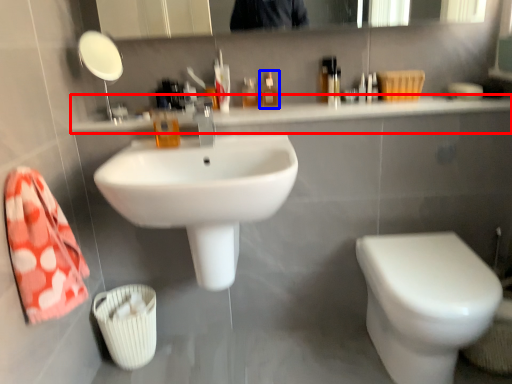
Question: Which object appears closest to the camera in this image, counter top (highlighted by a red box) or mouthwash (highlighted by a blue box)?

Choices:
 (A) counter top
 (B) mouthwash

Answer: (A)